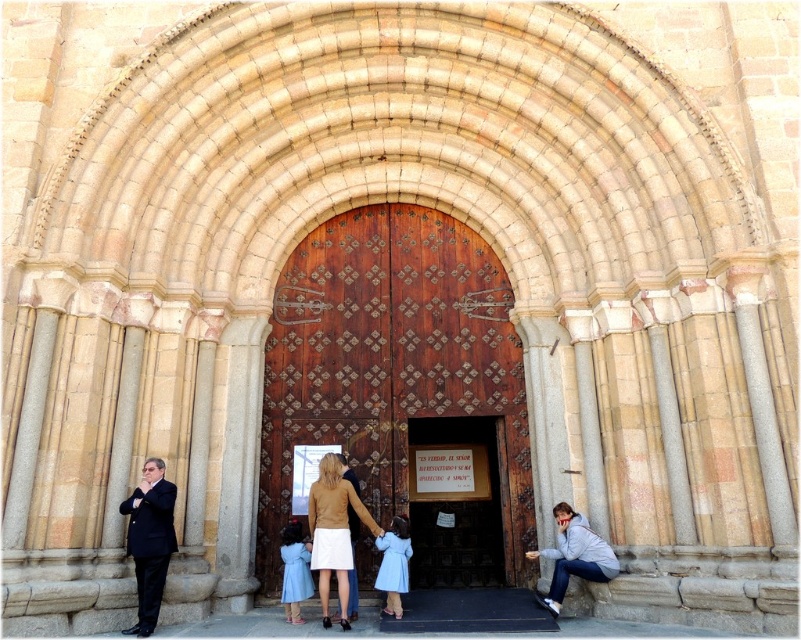
You are standing at the entrance of the historic building and see the matte brown jacket at center. You want to take a photo of the intricate wooden door using your camera. Can you reach the camera from your current position without moving? Explain your reasoning.

The matte brown jacket at center and camera are 35.38 meters apart from each other. Since you are at the entrance where the matte brown jacket at center is located, the camera is too far away to reach without moving. Therefore, you cannot take the photo without moving closer to the camera.